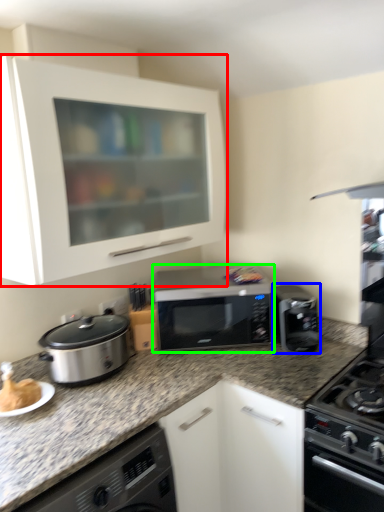
Question: Which object is positioned farthest from cabinetry (highlighted by a red box)? Select from kitchen appliance (highlighted by a blue box) and microwave oven (highlighted by a green box).

Choices:
 (A) kitchen appliance
 (B) microwave oven

Answer: (A)